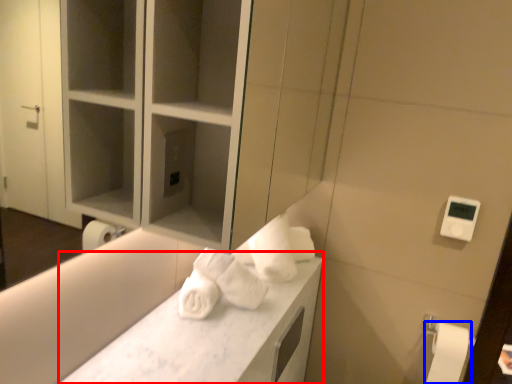
Question: Among these objects, which one is farthest to the camera, counter top (highlighted by a red box) or toilet paper (highlighted by a blue box)?

Choices:
 (A) counter top
 (B) toilet paper

Answer: (B)